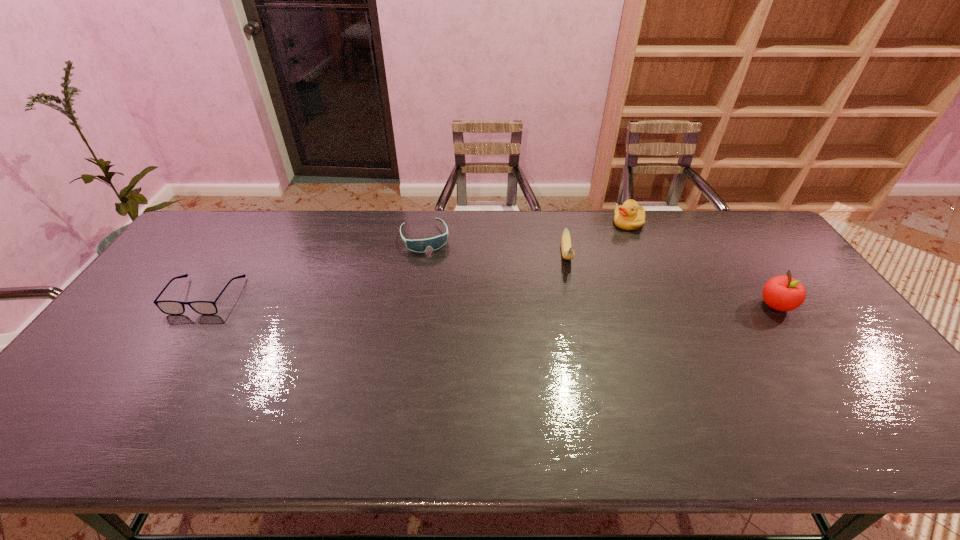
The width and height of the screenshot is (960, 540). I want to click on spectacles, so click(168, 307).

The height and width of the screenshot is (540, 960). Identify the location of the rightmost object. (783, 293).

What are the coordinates of `apple` in the screenshot? It's located at pyautogui.click(x=783, y=293).

Image resolution: width=960 pixels, height=540 pixels. I want to click on the third object from left to right, so click(x=568, y=253).

Identify the location of goggles. This screenshot has width=960, height=540. (417, 245).

Find the location of a particular element. This screenshot has height=540, width=960. duckling is located at coordinates (629, 216).

Locate an element on the screen. This screenshot has height=540, width=960. vacant space located on the front-facing side of the leftmost object is located at coordinates (170, 349).

I want to click on free region located 0.350m on the back of the tallest object, so click(720, 225).

Image resolution: width=960 pixels, height=540 pixels. Identify the location of vacant space situated at the stem of the third object from left to right. (578, 335).

Where is `vacant area situated 0.060m at the stem of the third object from left to right`? vacant area situated 0.060m at the stem of the third object from left to right is located at coordinates (572, 287).